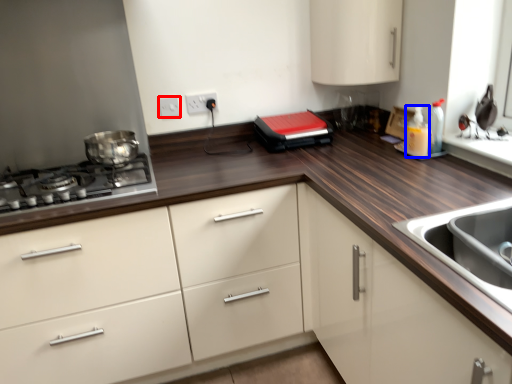
Question: Among these objects, which one is farthest to the camera, electric outlet (highlighted by a red box) or bottle (highlighted by a blue box)?

Choices:
 (A) electric outlet
 (B) bottle

Answer: (A)